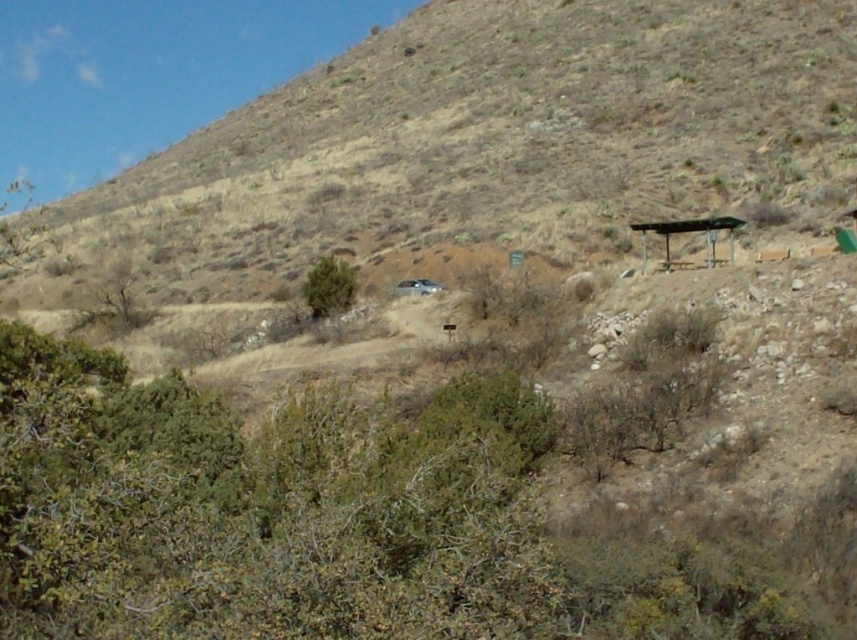
Between point (706, 1) and point (355, 292), which one is positioned in front?

Point (355, 292) is more forward.

The width and height of the screenshot is (857, 640). Describe the element at coordinates (490, 134) in the screenshot. I see `brown/dry grass at center` at that location.

Locate an element on the screen. Image resolution: width=857 pixels, height=640 pixels. brown/dry grass at center is located at coordinates (490, 134).

Is green leafy bush at center above metallic silver bus stop at right?

Actually, green leafy bush at center is below metallic silver bus stop at right.

Between green leafy bush at center and metallic silver bus stop at right, which one has less height?

Standing shorter between the two is metallic silver bus stop at right.

At what (x,y) coordinates should I click in order to perform the action: click on green leafy bush at center. Please return your answer as a coordinate pair (x, y). This screenshot has width=857, height=640. Looking at the image, I should click on (328, 285).

Does brown/dry grass at center have a larger size compared to metallic silver bus stop at right?

Indeed, brown/dry grass at center has a larger size compared to metallic silver bus stop at right.

Who is more distant from viewer, (399, 188) or (680, 225)?

The point (399, 188) is more distant.

In order to click on brown/dry grass at center in this screenshot , I will do `click(490, 134)`.